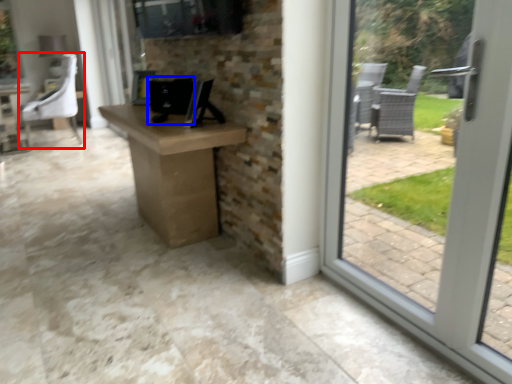
Question: Which object appears farthest to the camera in this image, chair (highlighted by a red box) or desktop computer (highlighted by a blue box)?

Choices:
 (A) chair
 (B) desktop computer

Answer: (A)